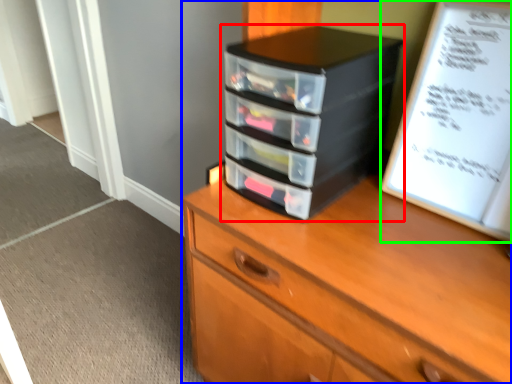
Question: Which is farther away from nightstand (highlighted by a red box)? chest of drawers (highlighted by a blue box) or paperback book (highlighted by a green box)?

Choices:
 (A) chest of drawers
 (B) paperback book

Answer: (A)